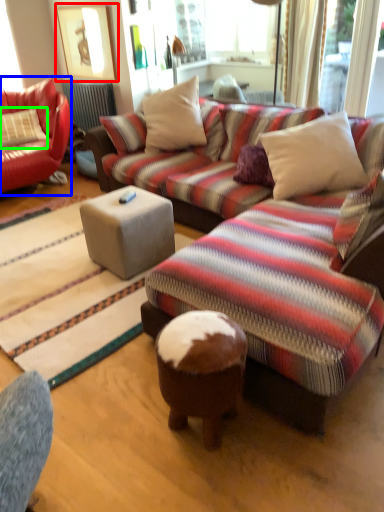
Question: Estimate the real-world distances between objects in this image. Which object is farther from picture frame (highlighted by a red box), studio couch (highlighted by a blue box) or pillow (highlighted by a green box)?

Choices:
 (A) studio couch
 (B) pillow

Answer: (B)